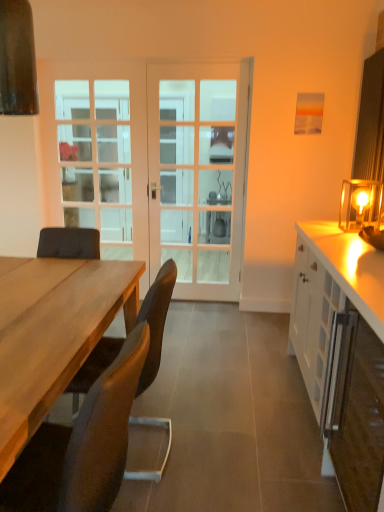
Question: Considering the positions of white glass door at center and white glossy cabinet at right, positioned as the second cabinetry in front-to-back order, in the image, is white glass door at center bigger or smaller than white glossy cabinet at right, positioned as the second cabinetry in front-to-back order,?

Choices:
 (A) small
 (B) big

Answer: (A)

Question: From a real-world perspective, is white glass door at center above or below white glossy cabinet at right, positioned as the second cabinetry in front-to-back order?

Choices:
 (A) above
 (B) below

Answer: (A)

Question: Estimate the real-world distances between objects in this image. Which object is closer to the matte brown exhaust hood at upper left?

Choices:
 (A) brown leather chair at lower left, the first chair positioned from the back
 (B) white glossy cabinet at right, the first cabinetry positioned from the front
 (C) white glossy cabinet at right, which is counted as the 1th cabinetry, starting from the back
 (D) clear glass door at center
 (E) matte glass table lamp at right

Answer: (A)

Question: Based on their relative distances, which object is nearer to the white glass door at center?

Choices:
 (A) white glossy cabinet at right, positioned as the second cabinetry in front-to-back order
 (B) matte brown exhaust hood at upper left
 (C) white glass screen door at center
 (D) brown leather chair at lower left, the first chair positioned from the back
 (E) matte glass table lamp at right

Answer: (C)